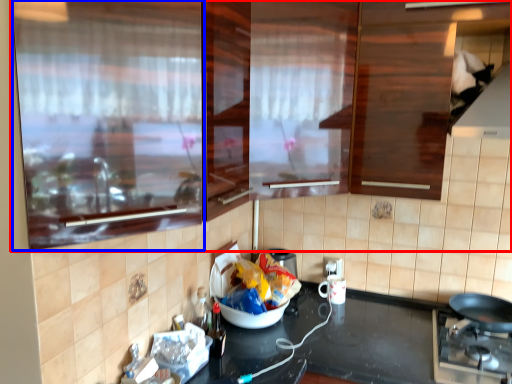
Question: Which of the following is the closest to the observer, cabinetry (highlighted by a red box) or glass door (highlighted by a blue box)?

Choices:
 (A) cabinetry
 (B) glass door

Answer: (A)